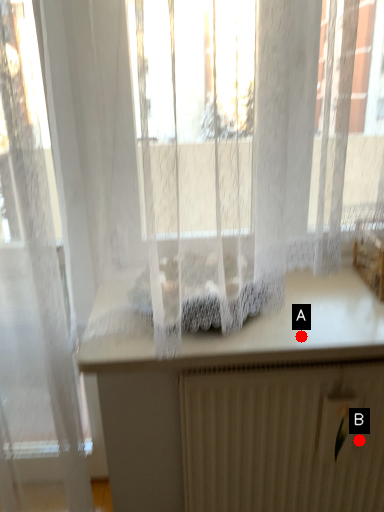
Question: Two points are circled on the image, labeled by A and B beside each circle. Which point is closer to the camera taking this photo?

Choices:
 (A) A is closer
 (B) B is closer

Answer: (A)